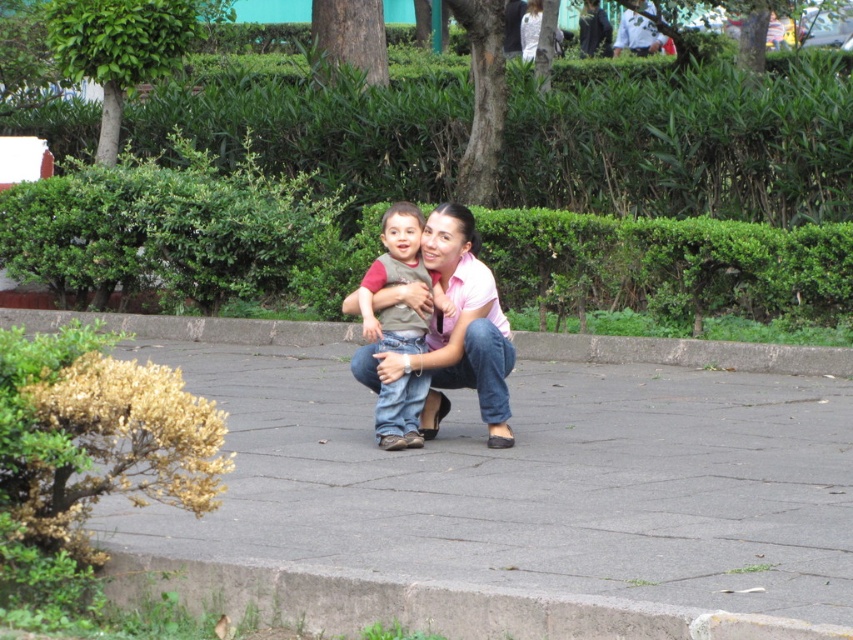
Based on the photo, you are standing at the edge of the paved area and want to place a small potted plant on the concrete at center so that it is visible from where you are standing. However, you also need to ensure that the matte brown vest at center does not block the view of the plant. Can you do this?

The concrete at center is further to the viewer than the matte brown vest at center, so placing the plant on the concrete at center would place it behind the matte brown vest at center, which would block the view. Therefore, you cannot do this.

You are standing at the edge of the paved area and want to walk to the grassy area. There is a concrete at center and a matte brown vest at center in your way. Which object should you move around to reach the grassy area?

The concrete at center is positioned on the left side of matte brown vest at center, so you should move around the matte brown vest at center to reach the grassy area.